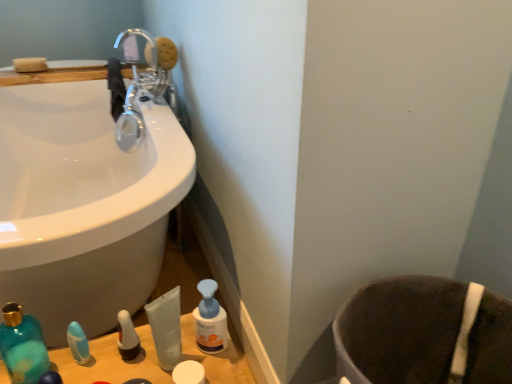
Identify the location of free space that is in between white matte container at lower center, the 1th toiletry in the right-to-left sequence, and blue glossy tube at lower left, positioned as the 1th toiletry in left-to-right order. Image resolution: width=512 pixels, height=384 pixels. (132, 362).